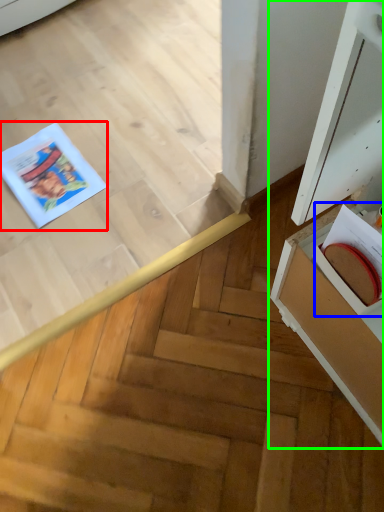
Question: Considering the real-world distances, which object is farthest from comic book (highlighted by a red box)? book (highlighted by a blue box) or cabinetry (highlighted by a green box)?

Choices:
 (A) book
 (B) cabinetry

Answer: (A)